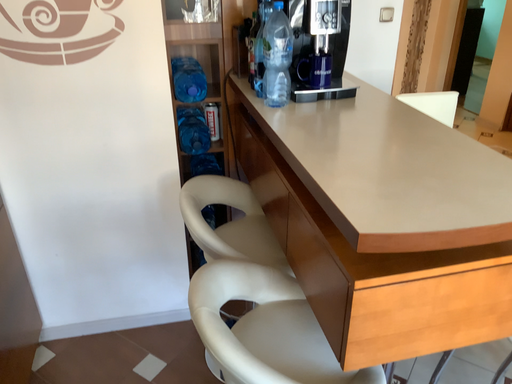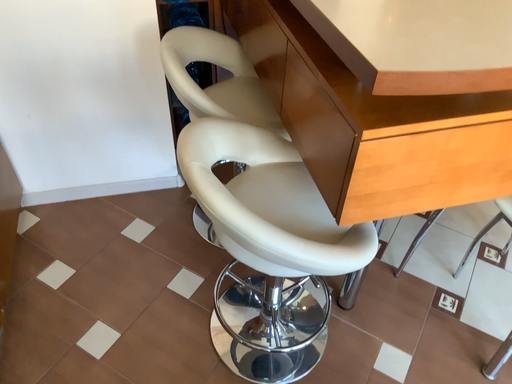
Question: How did the camera likely rotate when shooting the video?

Choices:
 (A) rotated downward
 (B) rotated upward

Answer: (A)